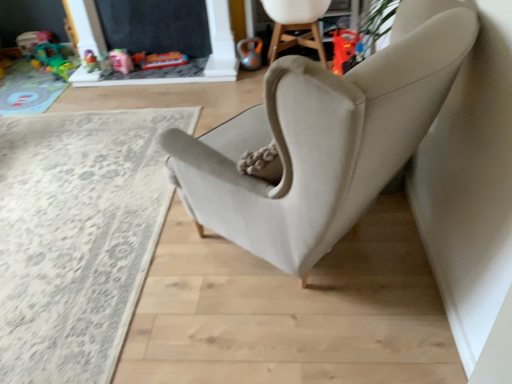
I want to click on empty space that is ontop of plastic toy car at upper center, positioned as the second toy in right-to-left order, so pyautogui.click(x=164, y=47).